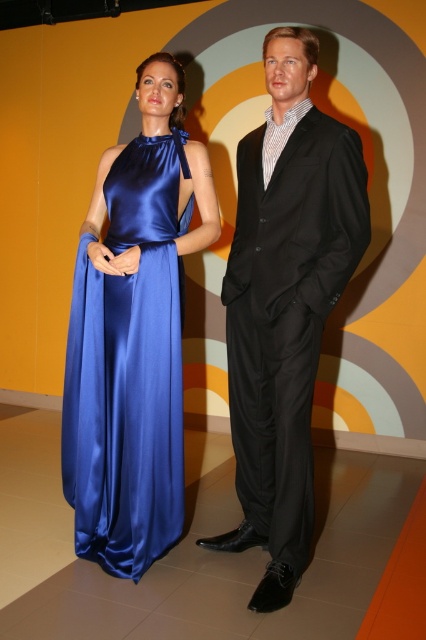
In the scene shown: Can you confirm if black satin suit at center is smaller than satin blue dress at left?

Incorrect, black satin suit at center is not smaller in size than satin blue dress at left.

Between black satin suit at center and satin blue dress at left, which one has less height?

Standing shorter between the two is satin blue dress at left.

Does point (351, 204) come farther from viewer compared to point (132, 541)?

No, it is not.

Where is `black satin suit at center`? Image resolution: width=426 pixels, height=640 pixels. black satin suit at center is located at coordinates (285, 304).